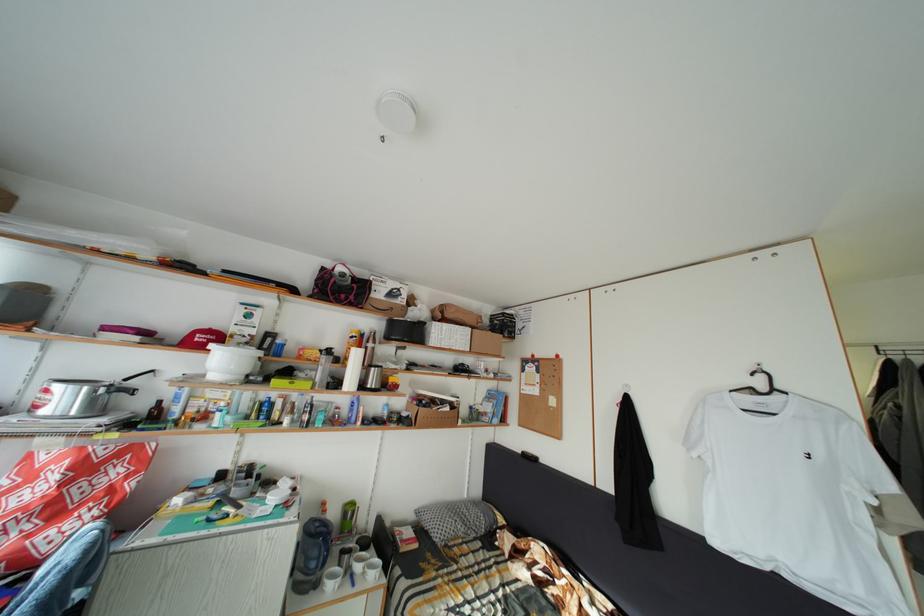
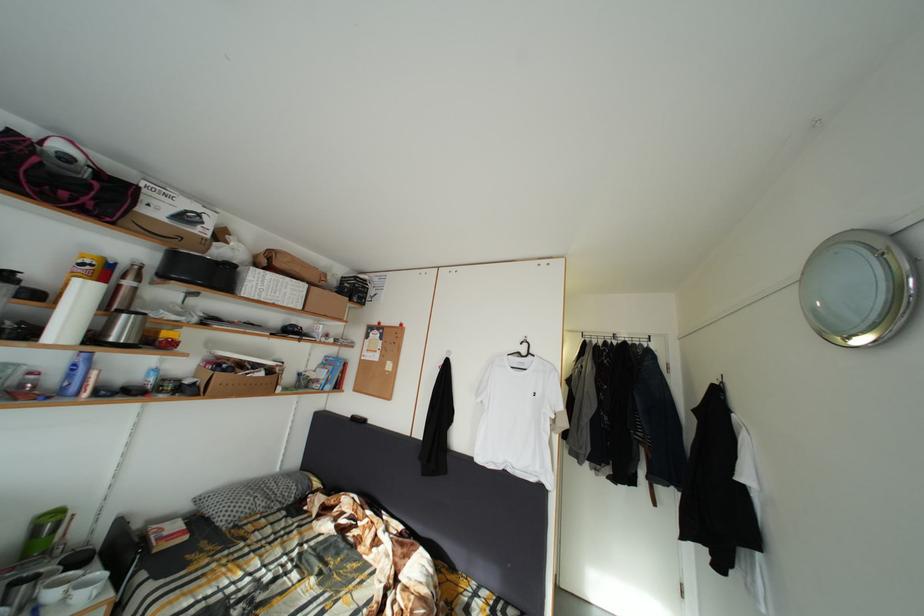
Where in the second image is the point corresponding to the point at 380,347 from the first image?

(140, 283)